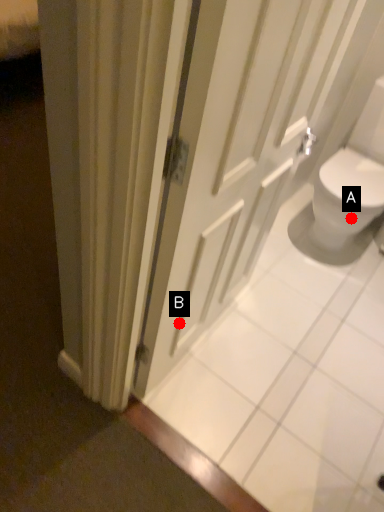
Question: Two points are circled on the image, labeled by A and B beside each circle. Which point appears farthest from the camera in this image?

Choices:
 (A) A is further
 (B) B is further

Answer: (A)